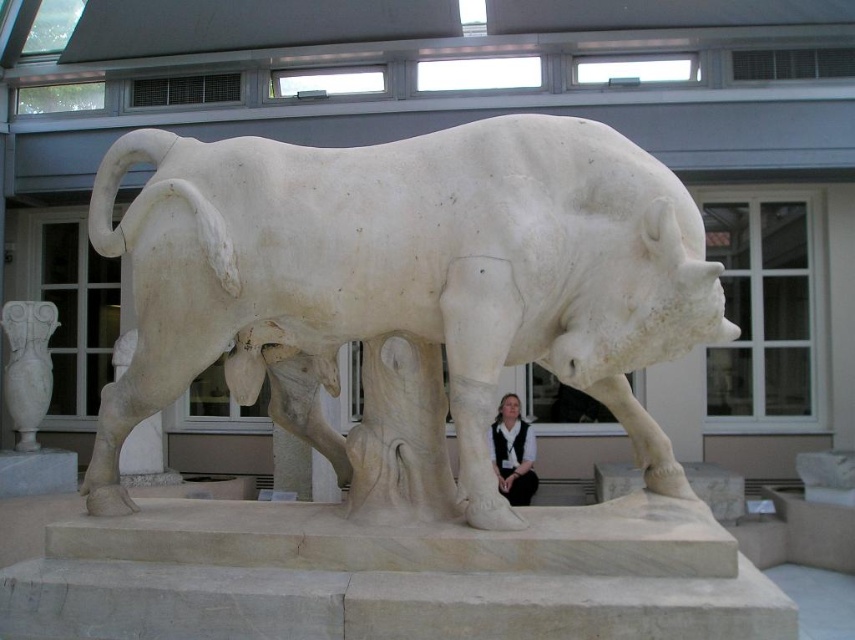
Can you confirm if white marble bull at center is positioned below white fabric at lower center?

No.

Is point (193, 182) less distant than point (525, 474)?

Yes, it is.

Where is `white marble bull at center`? Image resolution: width=855 pixels, height=640 pixels. white marble bull at center is located at coordinates (405, 276).

Looking at this image, who is positioned more to the left, white marble vase at left or white fabric at lower center?

From the viewer's perspective, white marble vase at left appears more on the left side.

Between point (34, 333) and point (513, 451), which one is positioned in front?

Point (34, 333) is more forward.

Does point (16, 339) lie in front of point (523, 445)?

Yes, it is.

Locate an element on the screen. The image size is (855, 640). white marble vase at left is located at coordinates (27, 365).

Which is above, white marble bull at center or white marble vase at left?

white marble bull at center is higher up.

Image resolution: width=855 pixels, height=640 pixels. I want to click on white marble bull at center, so click(405, 276).